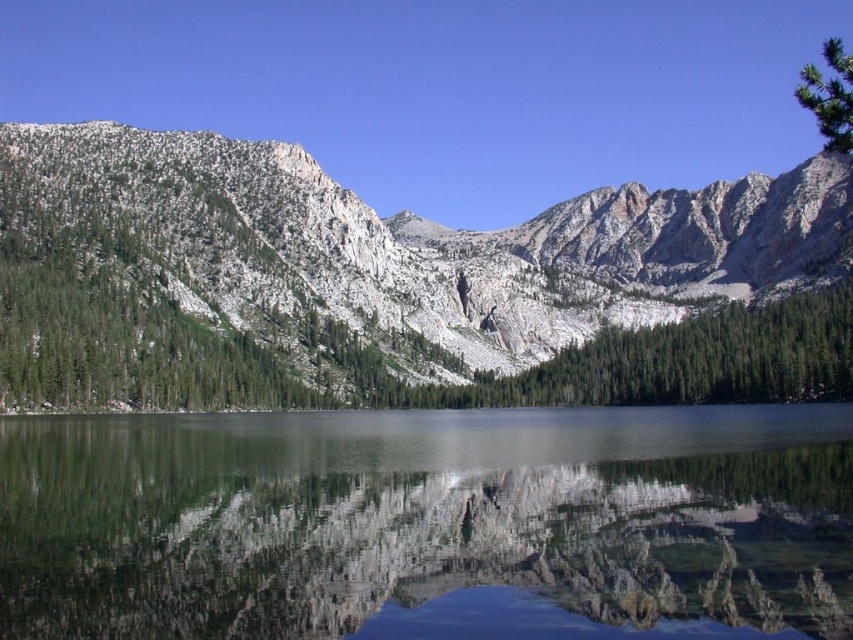
Based on the photo, you are a photographer planning to capture the reflection of the green textured mountain at center in the clear glass water at center. Given that the mountain is wider than the water, will the entire mountain fit within the water surface for a perfect reflection?

The green textured mountain at center is wider than the clear glass water at center, so the entire mountain will not fit within the water surface for a perfect reflection.

You are standing at the edge of the lake and see the green textured mountain at center and the clear glass water at center. Which object is located to the right of the other?

The green textured mountain at center is positioned on the right side of clear glass water at center.

You are standing at the edge of the lake and want to take a photo of the green textured mountain at center. According to the coordinates provided, where should you position yourself to capture the mountain in the center of your frame?

The green textured mountain at center is located at point coordinates (399, 285), so positioning yourself at the edge of the lake directly facing those coordinates will center the mountain in your photo.